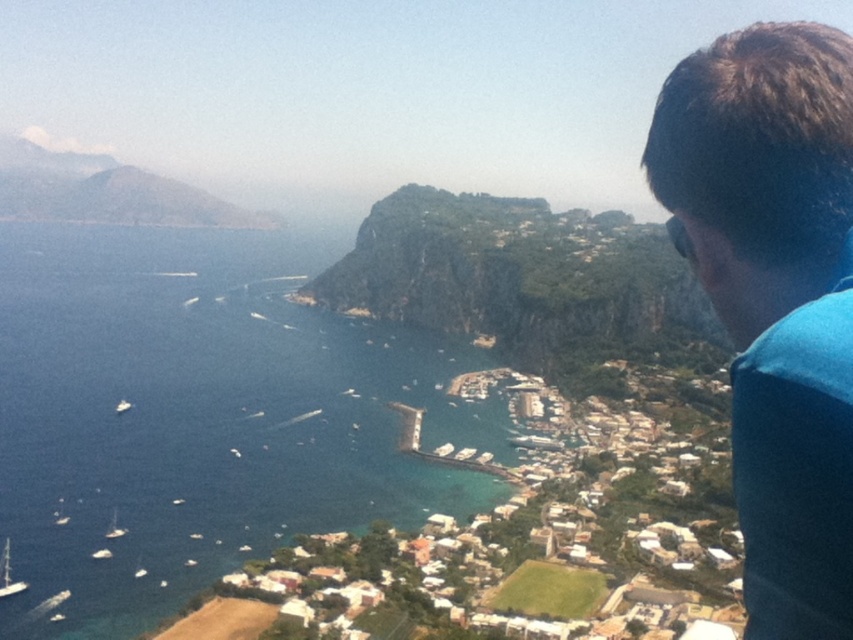
You are a photographer standing at the vantage point overlooking the coastal town. You want to capture a photo that includes both the green rock cliff at center and the white matte boat at lower left. Based on their positions, will the cliff obscure the boat in the photo?

The green rock cliff at center is positioned over the white matte boat at lower left, so the cliff will partially or fully obscure the boat in the photo depending on the camera angle and zoom level.

You are a photographer planning to capture a wide shot of the coastal town. You notice the blue water at center and the green rock cliff at center. Which of these two elements will occupy more space in your photo?

The blue water at center is bigger than the green rock cliff at center, so it will occupy more space in the photo.

You are standing at the vantage point overlooking the coastal town. There is a point marked at coordinates (202, 417). What is located at that point?

The point at coordinates (202, 417) marks blue water at center.